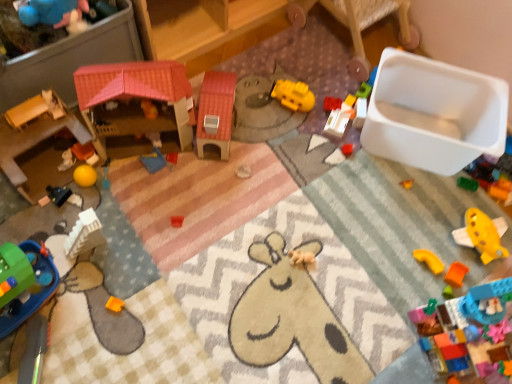
Identify the location of vacant space in between orange matte block at lower right, which ranks as the second toy in right-to-left order, and blue plastic tray at center, which ranks as the 10th toy in right-to-left order. coord(286,218).